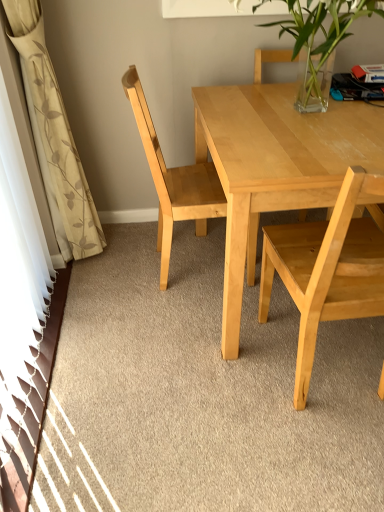
Locate an element on the screen. This screenshot has height=512, width=384. free region under white floral fabric curtain at left (from a real-world perspective) is located at coordinates click(90, 269).